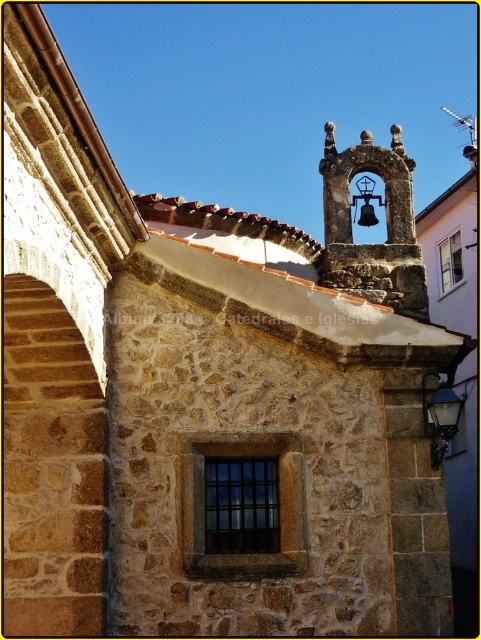
You are an architect examining the stone wall of a historic building. You notice two windows labeled as the brown stone window at center and the black glass window at center. Which window is positioned higher on the wall?

The brown stone window at center is positioned higher on the wall than the black glass window at center.

You are an architect planning to install a new decorative element between the black glass window at center and the white glass window at upper right. The element requires a minimum of 50 meters of space. Based on the scene, will there be enough space?

The distance between the black glass window at center and the white glass window at upper right is 50.16 meters, which exceeds the required 50 meters. Therefore, there is sufficient space for the decorative element.